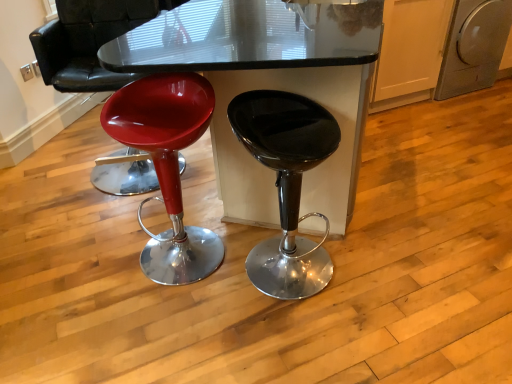
In order to click on free space in front of glossy plastic stool at left, which is the 2th stool in right-to-left order in this screenshot , I will do `click(167, 336)`.